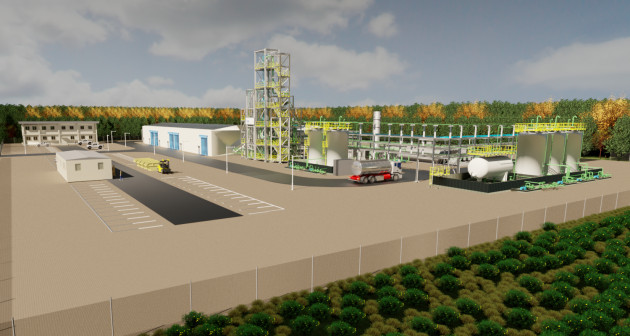
I want to click on stairs, so (285, 69), (280, 80), (280, 87), (281, 93), (283, 113), (283, 129), (283, 142), (283, 149).